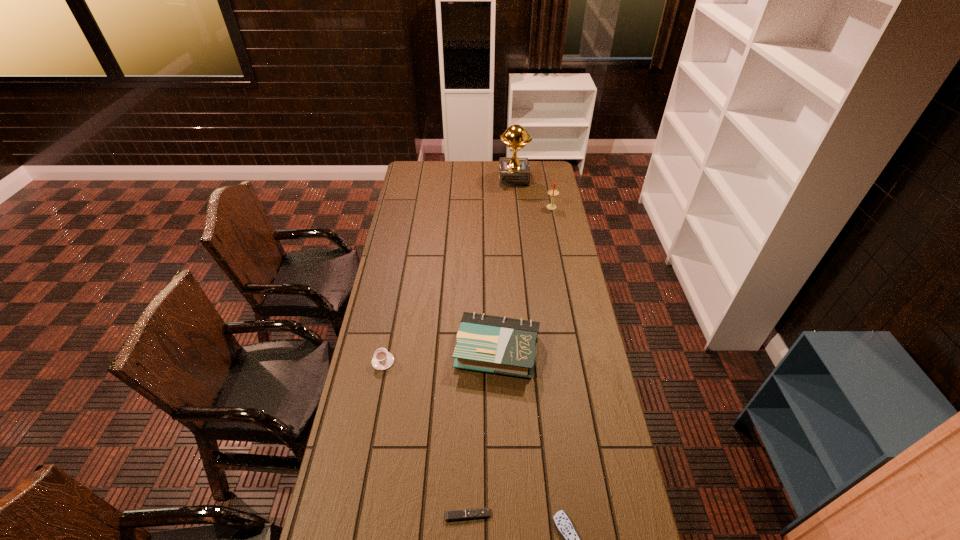
Find the location of a particular element. object that is at the far right corner is located at coordinates (513, 171).

Identify the location of free space at the far edge of the desktop. The image size is (960, 540). (492, 164).

This screenshot has height=540, width=960. In the image, there is a desktop. In order to click on vacant space at the left edge in this screenshot , I will do point(406,246).

The height and width of the screenshot is (540, 960). In order to click on vacant region at the right edge of the desktop in this screenshot , I will do `click(538, 241)`.

Find the location of a particular element. vacant space at the far left corner of the desktop is located at coordinates (415, 164).

The image size is (960, 540). Identify the location of free space between the award and the fifth nearest object. (533, 193).

Where is `unoccupied area between the award and the third shortest object`? This screenshot has width=960, height=540. unoccupied area between the award and the third shortest object is located at coordinates (448, 270).

Locate an element on the screen. vacant space in between the leftmost object and the shortest object is located at coordinates (425, 438).

Image resolution: width=960 pixels, height=540 pixels. I want to click on unoccupied position between the fourth shortest object and the shorter remote control, so click(x=483, y=433).

Locate an element on the screen. Image resolution: width=960 pixels, height=540 pixels. object that is the third closest to the farthest object is located at coordinates (382, 360).